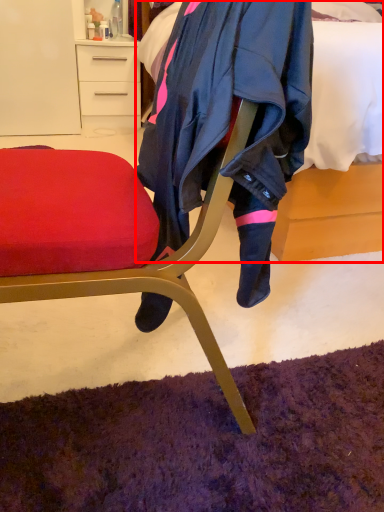
Question: From the image's perspective, considering the relative positions of bed (annotated by the red box) and desk in the image provided, where is bed (annotated by the red box) located with respect to the staircase?

Choices:
 (A) below
 (B) above

Answer: (A)